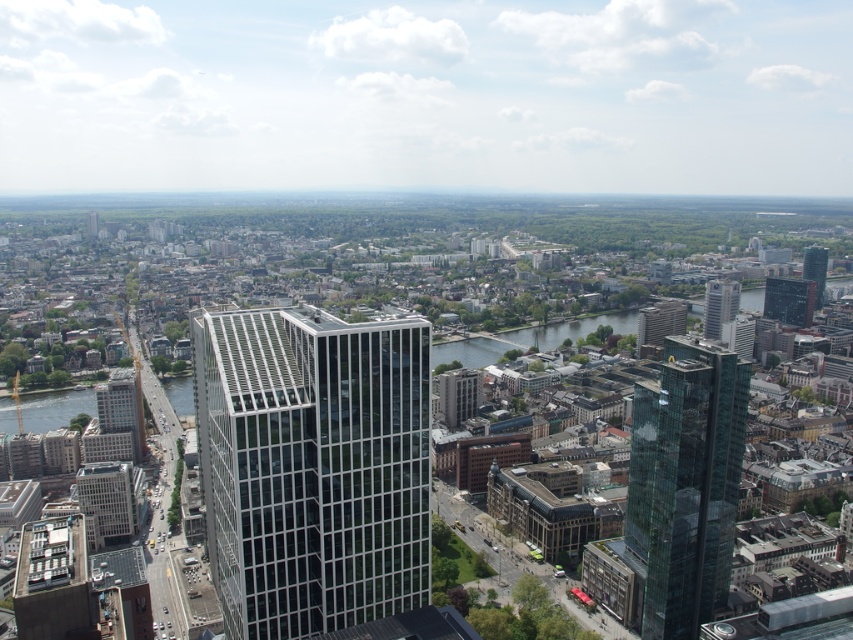
What do you see at coordinates (312, 467) in the screenshot? The width and height of the screenshot is (853, 640). I see `matte glass skyscraper at center` at bounding box center [312, 467].

Does matte glass skyscraper at center have a greater width compared to green glass skyscraper at center?

Incorrect, matte glass skyscraper at center's width does not surpass green glass skyscraper at center's.

Does point (396, 602) come closer to viewer compared to point (819, 269)?

Yes.

What are the coordinates of `matte glass skyscraper at center` in the screenshot? It's located at (312, 467).

Who is higher up, transparent glass skyscraper at right or green glass skyscraper at center?

green glass skyscraper at center is higher up.

The image size is (853, 640). What do you see at coordinates (683, 484) in the screenshot? I see `transparent glass skyscraper at right` at bounding box center [683, 484].

Find the location of a particular element. The image size is (853, 640). transparent glass skyscraper at right is located at coordinates (683, 484).

Find the location of a particular element. This screenshot has height=640, width=853. transparent glass skyscraper at right is located at coordinates (683, 484).

What do you see at coordinates (683, 484) in the screenshot? I see `transparent glass skyscraper at right` at bounding box center [683, 484].

This screenshot has height=640, width=853. I want to click on transparent glass skyscraper at right, so click(x=683, y=484).